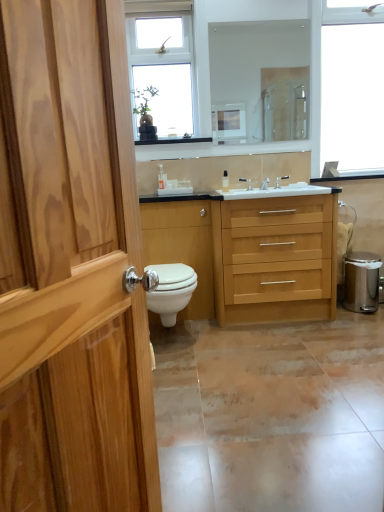
At what (x,y) coordinates should I click in order to perform the action: click on vacant space that is in between white glossy toilet at center and white glossy toilet at center. Please return your answer as a coordinate pair (x, y). Image resolution: width=384 pixels, height=512 pixels. Looking at the image, I should click on (203, 332).